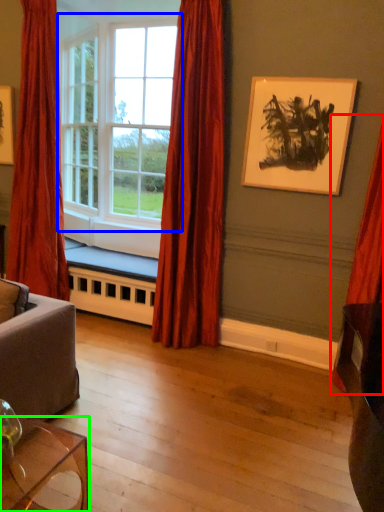
Question: Considering the real-world distances, which object is closest to curtain (highlighted by a red box)? window (highlighted by a blue box) or table (highlighted by a green box).

Choices:
 (A) window
 (B) table

Answer: (B)